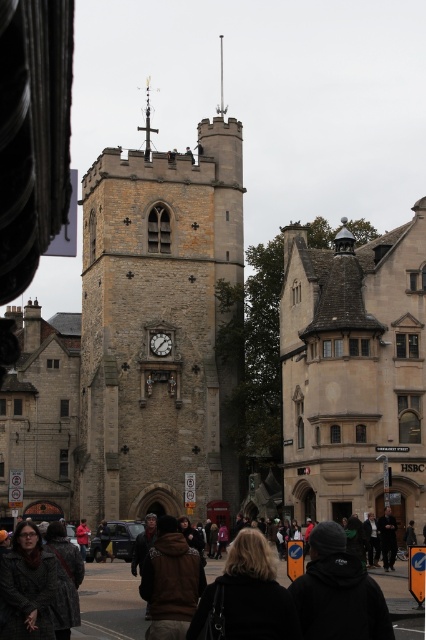
Question: Can you confirm if brown stone clock tower at center is thinner than white marble clock at center?

Choices:
 (A) yes
 (B) no

Answer: (B)

Question: Does dark brown leather jacket at lower center appear on the left side of white marble clock at center?

Choices:
 (A) yes
 (B) no

Answer: (B)

Question: Which point appears closest to the camera in this image?

Choices:
 (A) (207, 564)
 (B) (149, 337)
 (C) (140, 211)

Answer: (A)

Question: Which object is the closest to the dark brown leather jacket at lower center?

Choices:
 (A) white marble clock at center
 (B) brown stone clock tower at center

Answer: (B)

Question: Is brown stone clock tower at center further to camera compared to dark brown leather jacket at lower center?

Choices:
 (A) no
 (B) yes

Answer: (B)

Question: Which of the following is the farthest from the observer?

Choices:
 (A) white marble clock at center
 (B) brown stone clock tower at center
 (C) dark brown leather jacket at lower center

Answer: (A)